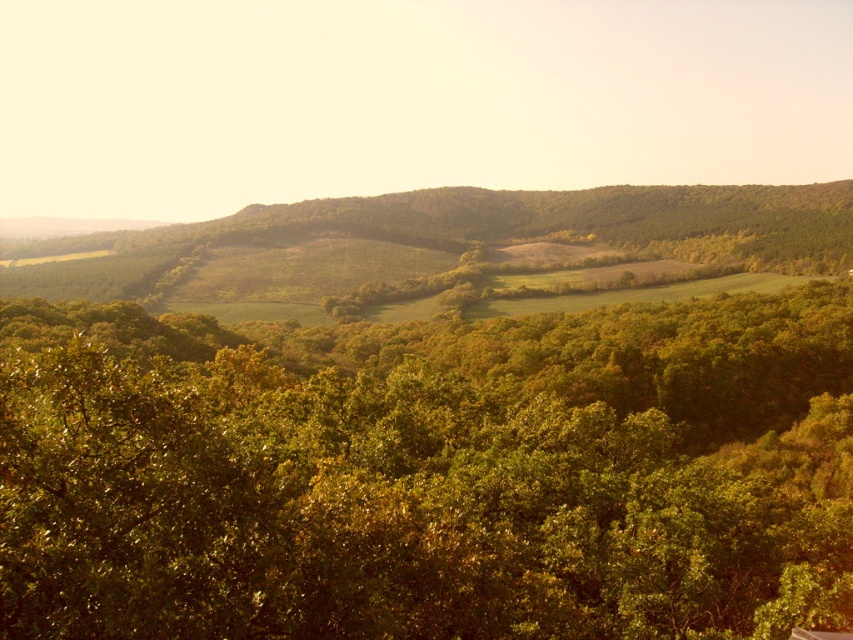
You are a hiker planning to walk from the green leafy trees at center to the green leafy hillside at center. Given that your average walking pace is 1.4 meters per second, how many minutes will it take you to reach the hillside?

The distance between the green leafy trees at center and the green leafy hillside at center is 309.96 meters. At a walking pace of 1.4 meters per second, it would take approximately 221.4 minutes to cover this distance.

You are an environmental scientist observing the landscape. You notice the green leafy trees at center and the green leafy hillside at center. Which of these two features is closer to your current position?

The green leafy trees at center are closer to your current position because they are positioned in front of the green leafy hillside at center.

You are an environmental scientist analyzing the image. You need to determine which object occupies more space in the scene. Based on the information provided, which one is larger in size between the green leafy trees at center and the green leafy hillside at center?

The green leafy hillside at center is larger in size than the green leafy trees at center.